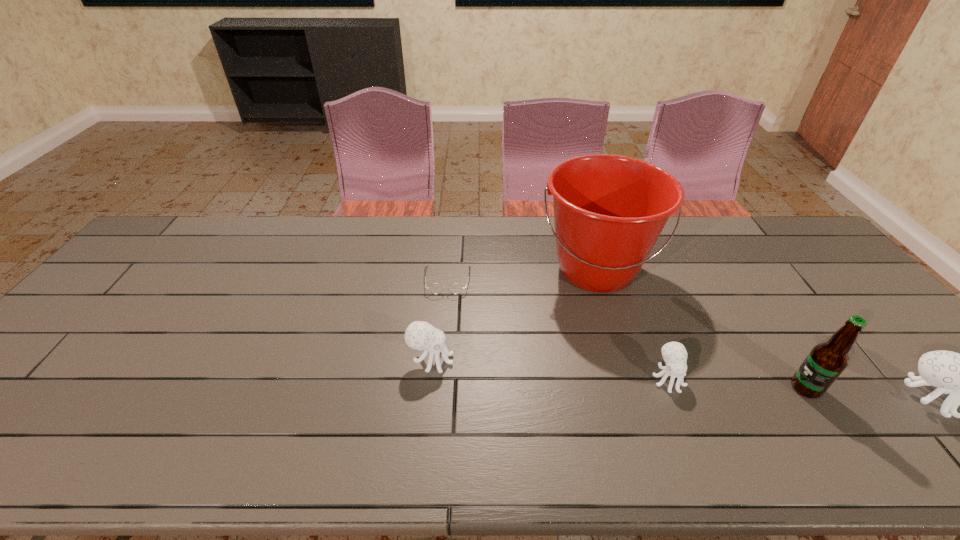
In the current image, all octopuss are evenly spaced. To maintain this equal spacing, where should an additional octopus be placed on the left? Please point out a free spot. Please provide its 2D coordinates. Your answer should be formatted as a tuple, i.e. [(x, y)], where the tuple contains the x and y coordinates of a point satisfying the conditions above.

[(211, 342)]